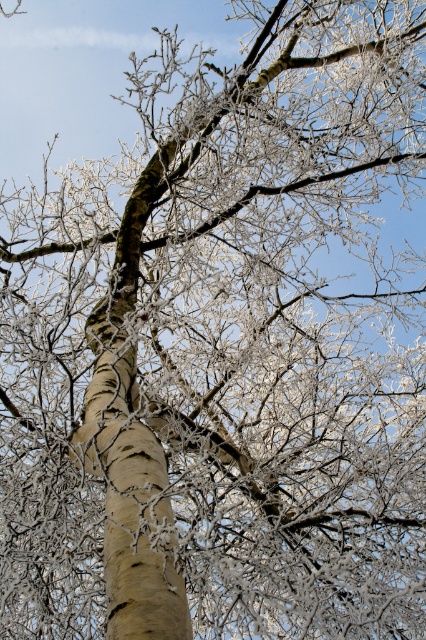
Is frosted bark branch at center below smooth beige bark at center?

Actually, frosted bark branch at center is above smooth beige bark at center.

Is frosted bark branch at center positioned behind smooth beige bark at center?

Yes, it is.

Where is `frosted bark branch at center`? This screenshot has height=640, width=426. frosted bark branch at center is located at coordinates (88, 70).